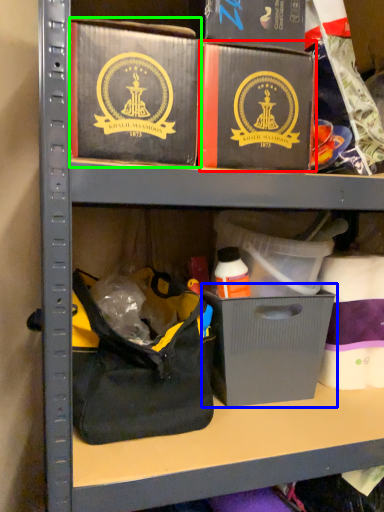
Question: Which is nearer to the box (highlighted by a red box)? cardboard box (highlighted by a blue box) or box (highlighted by a green box).

Choices:
 (A) cardboard box
 (B) box

Answer: (B)